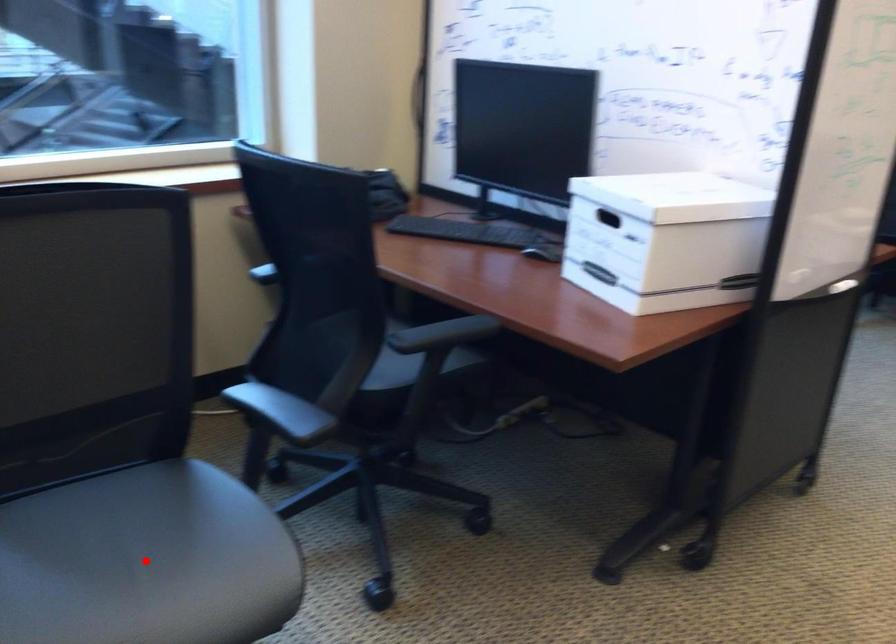
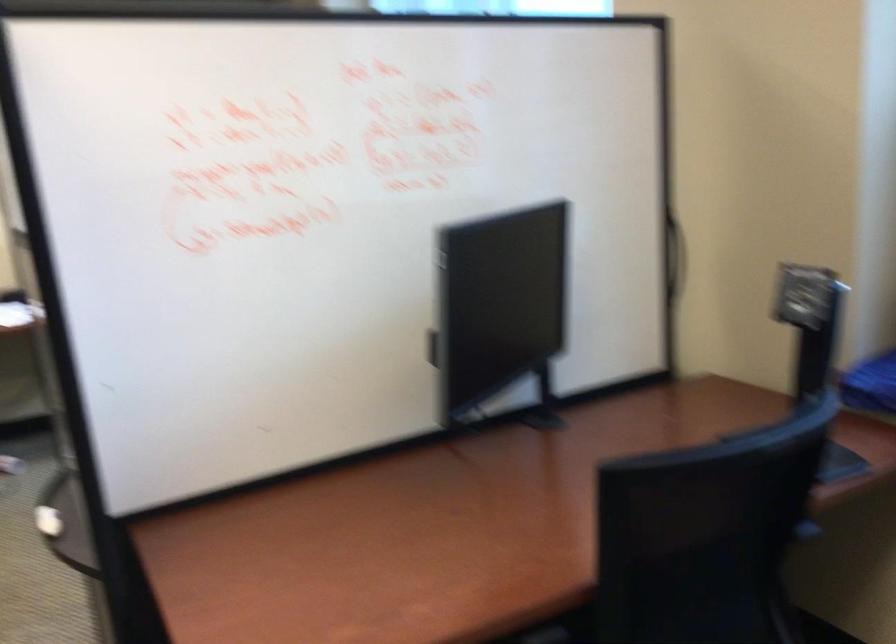
Question: I am providing you with two images of the same scene from different viewpoints. A red point is marked on the first image. Can you still see the location of the red point in image 2?

Choices:
 (A) Yes
 (B) No

Answer: (B)